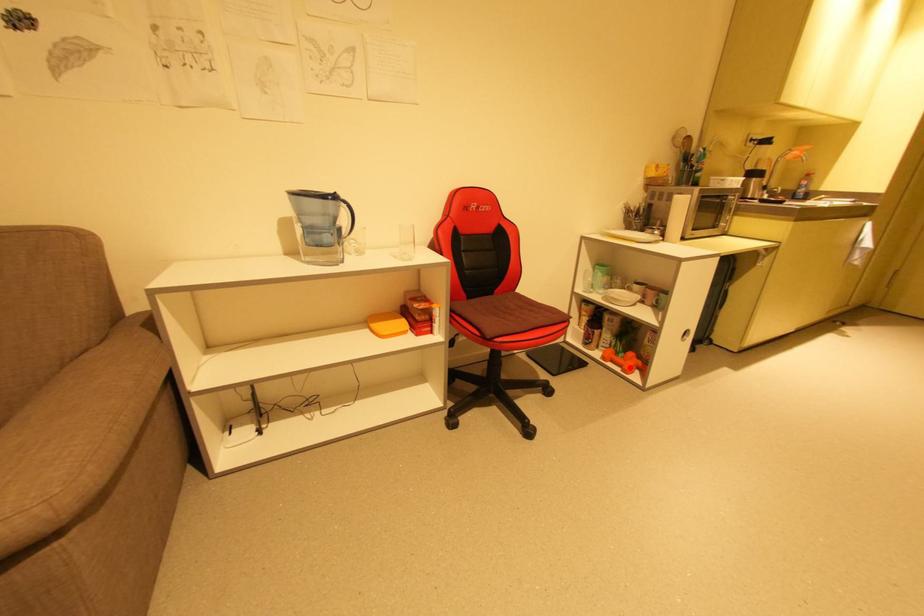
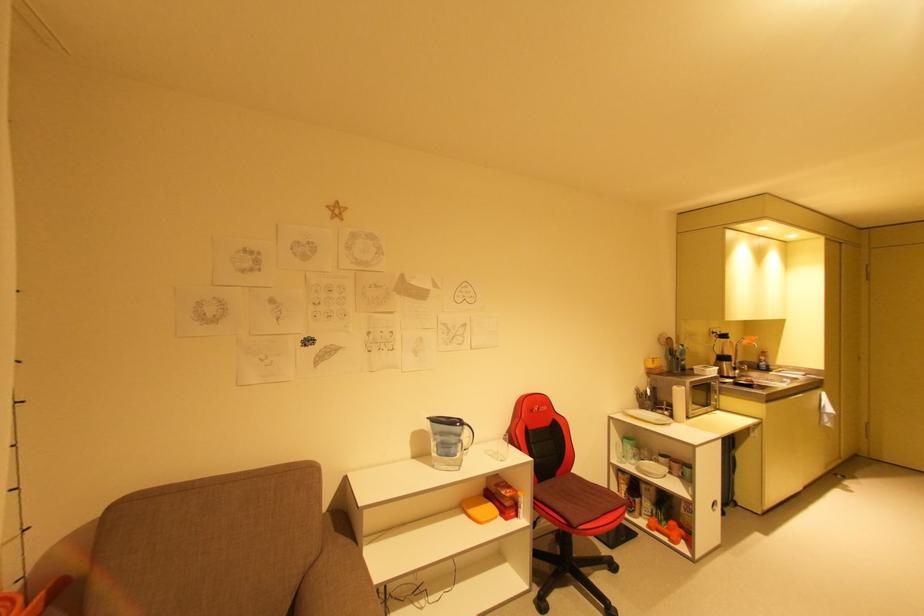
Question: A red point is marked in image1. In image2, is the corresponding 3D point closer to the camera or farther? Reply with the corresponding letter.

Choices:
 (A) The corresponding 3D point is closer.
 (B) The corresponding 3D point is farther.

Answer: (B)